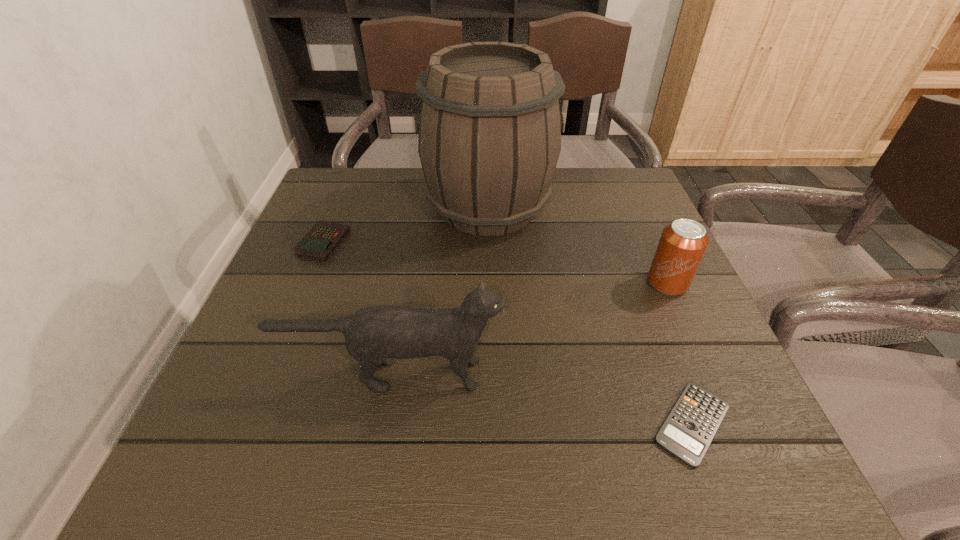
Where is `free location located on the left of the third farthest object`? This screenshot has height=540, width=960. free location located on the left of the third farthest object is located at coordinates (501, 283).

Locate an element on the screen. The image size is (960, 540). free space located 0.150m on the right of the taller calculator is located at coordinates (413, 242).

Image resolution: width=960 pixels, height=540 pixels. I want to click on free space located on the back of the nearer calculator, so click(657, 328).

Identify the location of object that is at the far edge. The width and height of the screenshot is (960, 540). (490, 128).

Where is `object located in the near edge section of the desktop`? object located in the near edge section of the desktop is located at coordinates (690, 427).

In order to click on cat that is at the left edge in this screenshot , I will do `click(374, 336)`.

The width and height of the screenshot is (960, 540). I want to click on calculator that is at the left edge, so click(318, 244).

The image size is (960, 540). I want to click on can that is at the right edge, so click(682, 245).

At what (x,y) coordinates should I click in order to perform the action: click on calculator situated at the right edge. Please return your answer as a coordinate pair (x, y). This screenshot has height=540, width=960. Looking at the image, I should click on (690, 427).

Where is `object located in the near right corner section of the desktop`? The width and height of the screenshot is (960, 540). object located in the near right corner section of the desktop is located at coordinates (690, 427).